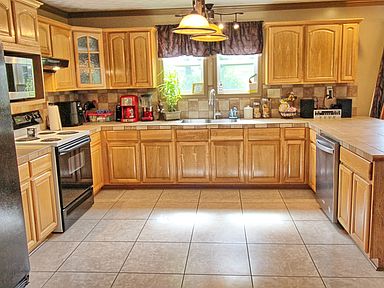
I want to click on cabinet that you can see into when closed, so click(x=89, y=61).